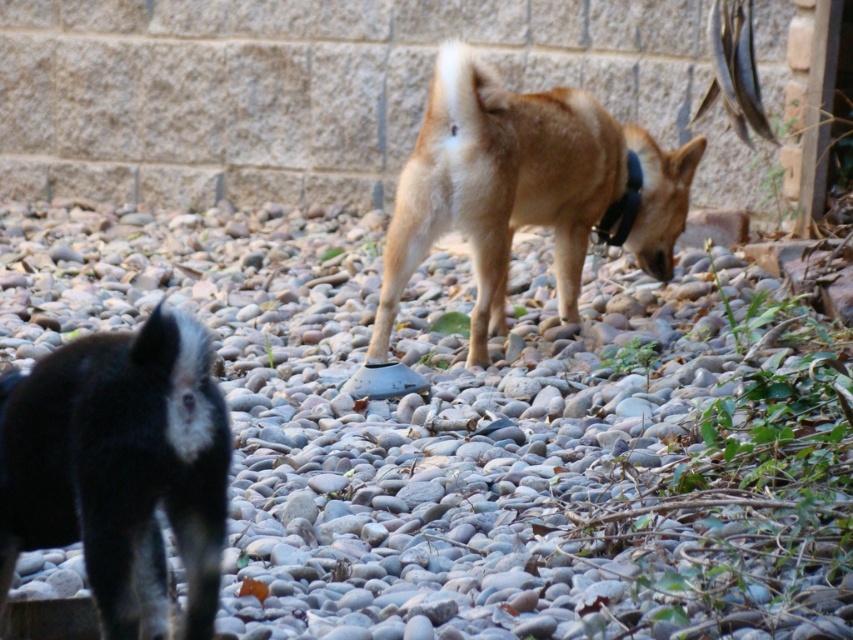
You are a photographer trying to capture the black fur dog at left and the black fabric neckband at center in your shot. Which object is nearer to your camera?

The black fur dog at left is closer to the viewer than the black fabric neckband at center, so the black fur dog at left would appear nearer in the photograph.

You are standing in the garden and see the light brown fur at center and the black fabric neckband at center. Which one is positioned to the left?

The light brown fur at center is positioned to the left of the black fabric neckband at center.

You are a photographer trying to capture both the black fur dog at left and the black fabric neckband at center in your shot. Which one is positioned lower in the frame?

The black fur dog at left is located below the black fabric neckband at center, so it is positioned lower in the frame.